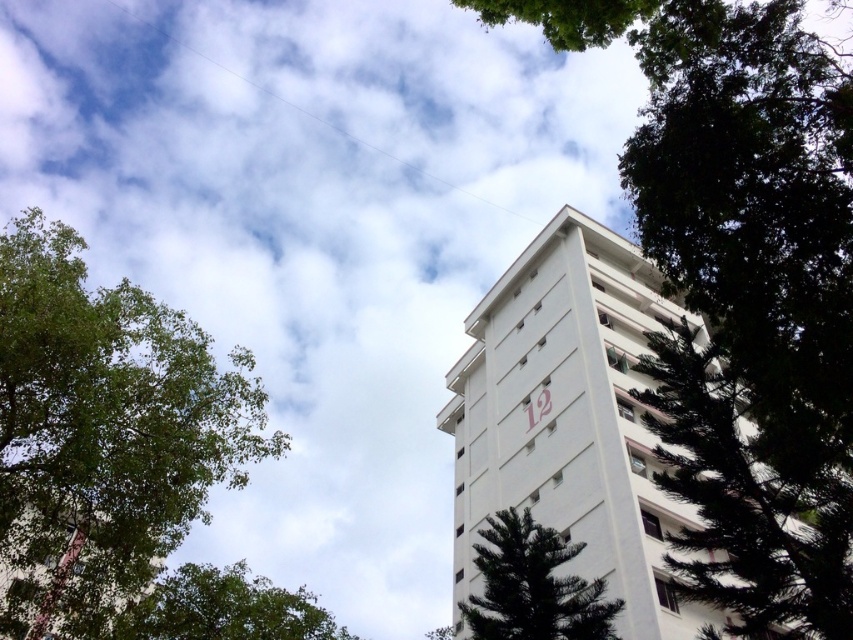
Question: Is white smooth building at center thinner than green leafy tree at lower left?

Choices:
 (A) yes
 (B) no

Answer: (A)

Question: Can you confirm if green leafy tree at upper right is wider than green textured tree at center?

Choices:
 (A) no
 (B) yes

Answer: (B)

Question: Estimate the real-world distances between objects in this image. Which object is farther from the green textured tree at center?

Choices:
 (A) white smooth building at center
 (B) green leafy tree at upper right
 (C) green leafy tree at left

Answer: (C)

Question: Is green leafy tree at upper right behind green leafy tree at left?

Choices:
 (A) no
 (B) yes

Answer: (A)

Question: Which object is positioned farthest from the green leafy tree at left?

Choices:
 (A) green leafy tree at lower left
 (B) green textured tree at center

Answer: (B)

Question: Which point is closer to the camera taking this photo?

Choices:
 (A) (492, 625)
 (B) (665, 12)
 (C) (316, 636)

Answer: (B)